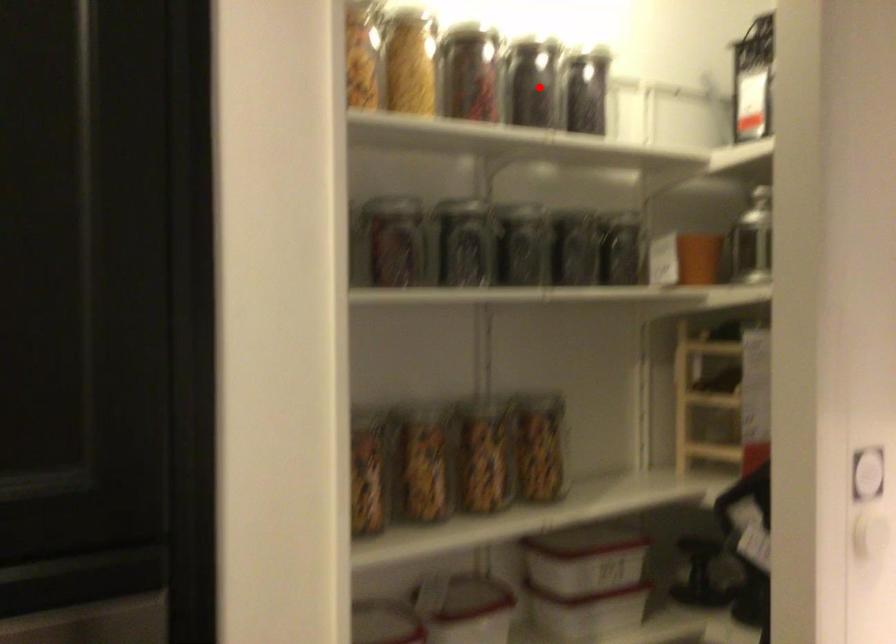
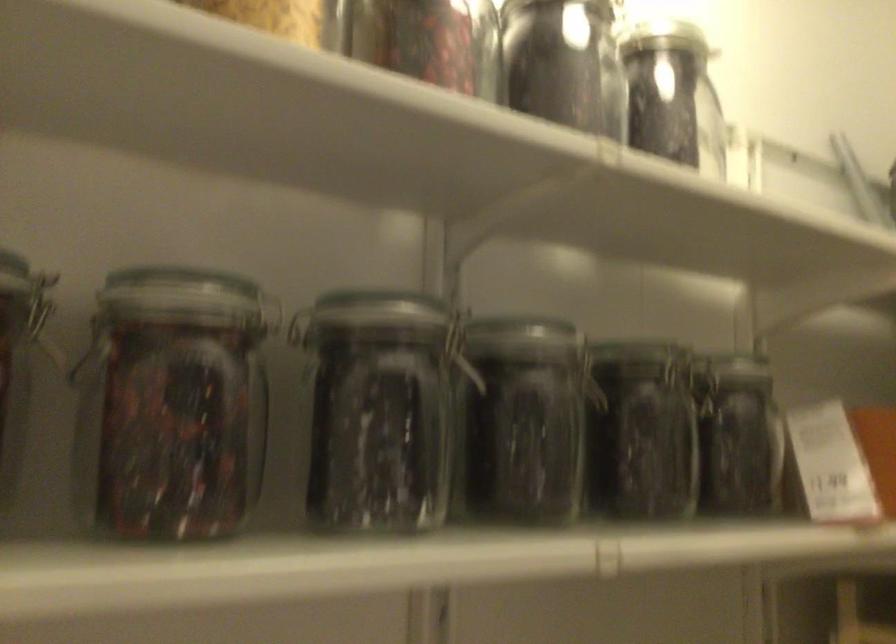
In the second image, find the point that corresponds to the highlighted location in the first image.

(564, 64)